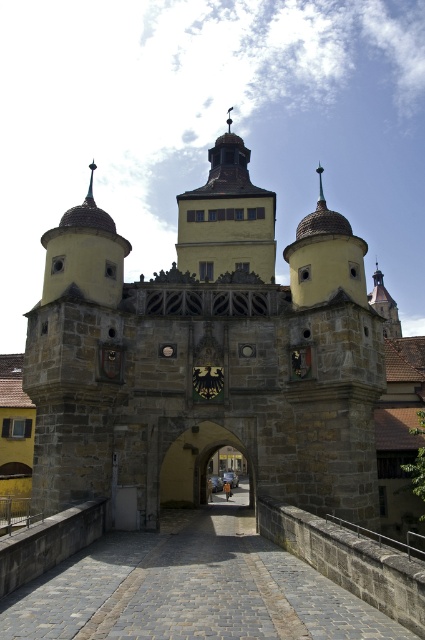
Question: Which point appears farthest from the camera in this image?

Choices:
 (A) (172, 499)
 (B) (87, 474)
 (C) (254, 189)

Answer: (C)

Question: Does stone church at center appear on the right side of yellow stone tower at center?

Choices:
 (A) yes
 (B) no

Answer: (A)

Question: Which of the following is the farthest from the observer?

Choices:
 (A) yellow stone tower at center
 (B) stone archway at center

Answer: (A)

Question: Can you confirm if stone church at center is positioned to the right of stone archway at center?

Choices:
 (A) no
 (B) yes

Answer: (B)

Question: Can you confirm if yellow stone tower at center is wider than stone archway at center?

Choices:
 (A) yes
 (B) no

Answer: (A)

Question: Which point is farther to the camera?

Choices:
 (A) stone archway at center
 (B) stone church at center
 (C) yellow stone tower at center

Answer: (C)